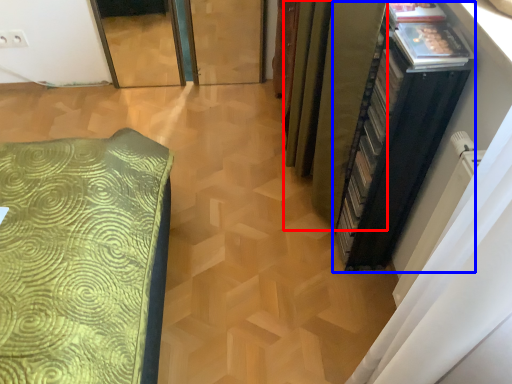
Question: Which of the following is the closest to the observer, curtain (highlighted by a red box) or file cabinet (highlighted by a blue box)?

Choices:
 (A) curtain
 (B) file cabinet

Answer: (B)